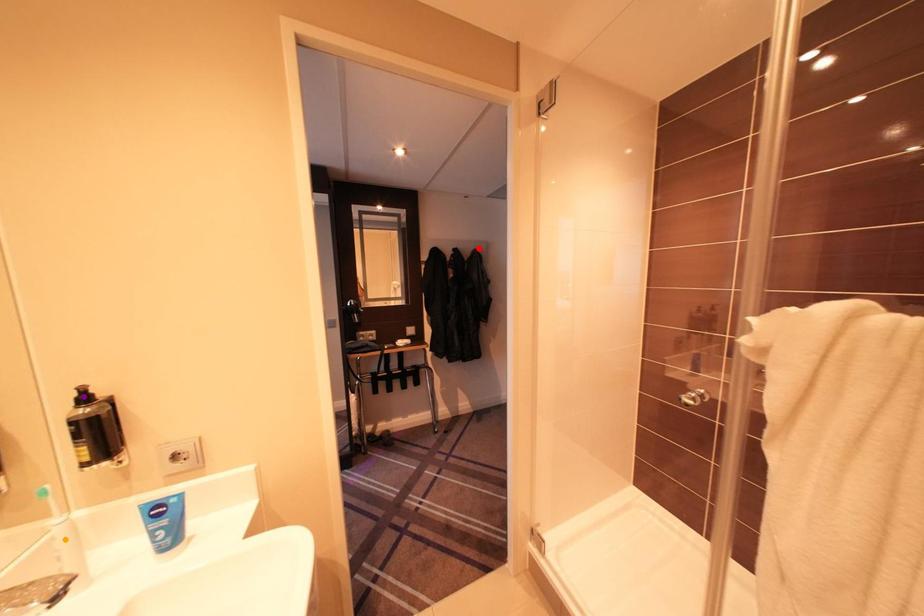
Order these from nearest to farthest:
- purple point
- red point
- orange point

red point → purple point → orange point